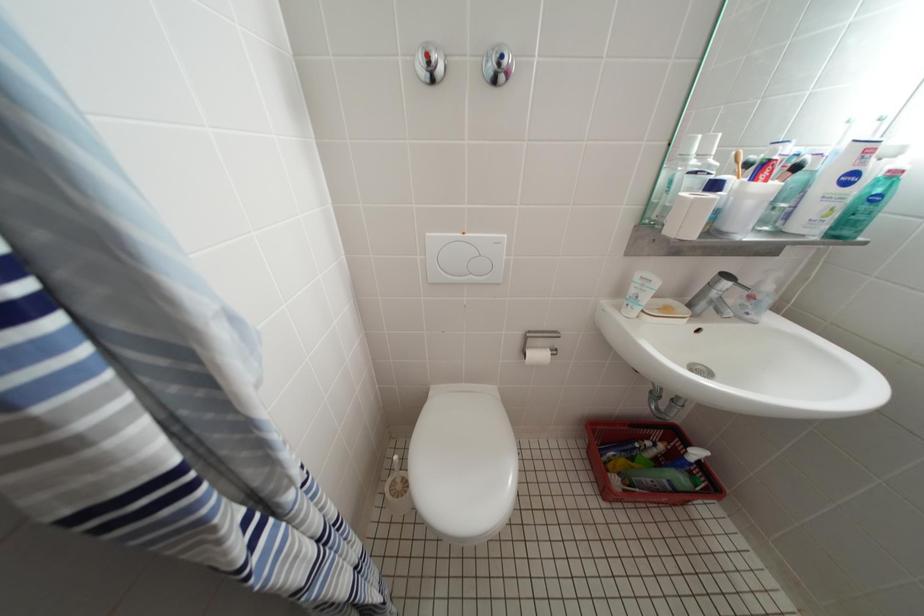
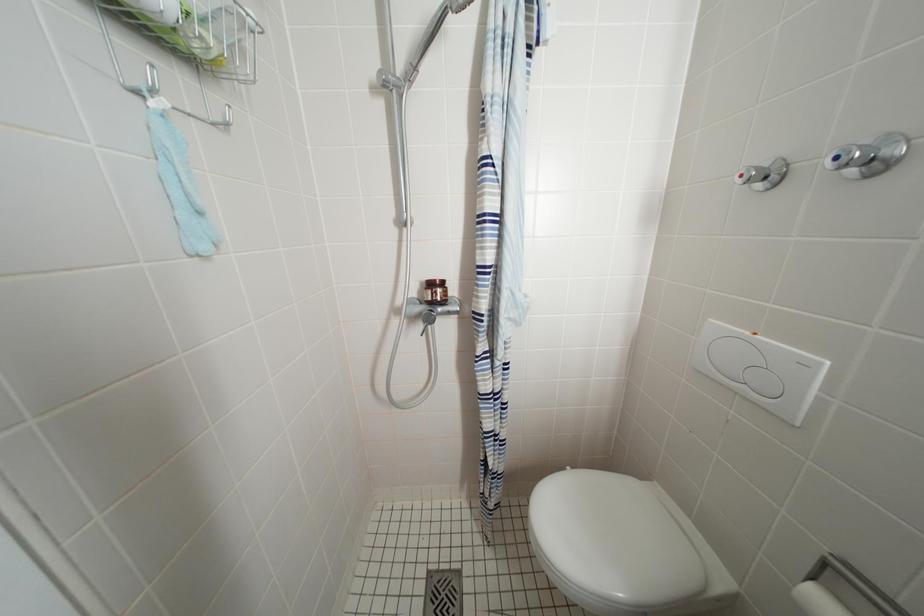
Question: The images are taken continuously from a first-person perspective. In which direction is your viewpoint rotating?

Choices:
 (A) Left
 (B) Right
 (C) Up
 (D) Down

Answer: (A)